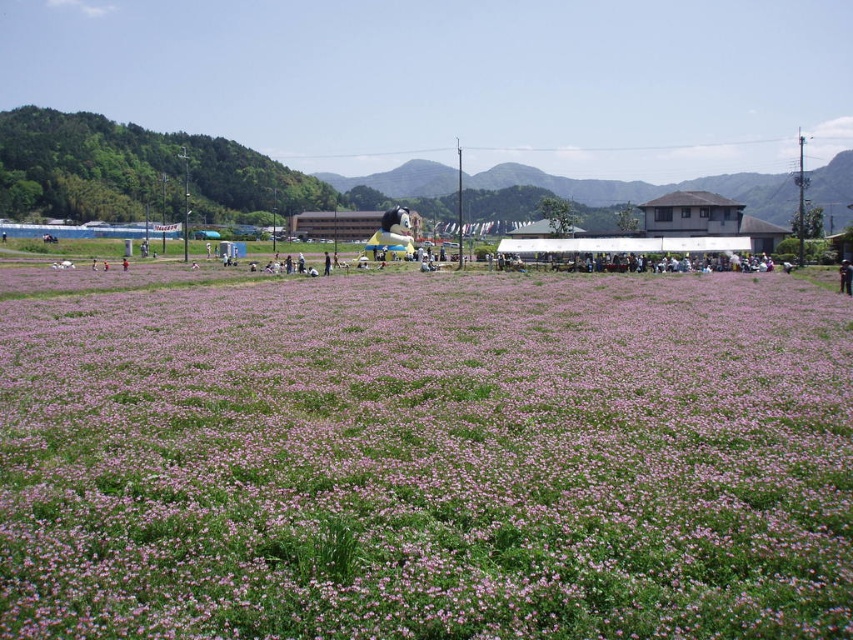
Which is in front, point (474, 305) or point (850, 284)?

Positioned in front is point (474, 305).

Which of these two, pink matte flowers at center or brown leather jacket at lower right, stands taller?

With more height is brown leather jacket at lower right.

Describe the element at coordinates (428, 460) in the screenshot. I see `pink matte flowers at center` at that location.

At what (x,y) coordinates should I click in order to perform the action: click on pink matte flowers at center. Please return your answer as a coordinate pair (x, y). Looking at the image, I should click on (428, 460).